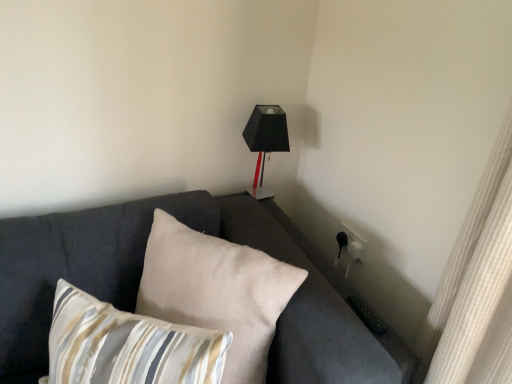
What do you see at coordinates (217, 291) in the screenshot? I see `beige fabric pillow at center, which is the first pillow in back-to-front order` at bounding box center [217, 291].

At what (x,y) coordinates should I click in order to perform the action: click on beige fabric pillow at center, which is the first pillow in back-to-front order. Please return your answer as a coordinate pair (x, y). This screenshot has width=512, height=384. Looking at the image, I should click on (217, 291).

This screenshot has width=512, height=384. What do you see at coordinates (127, 345) in the screenshot?
I see `striped fabric pillow at lower left, positioned as the 1th pillow in front-to-back order` at bounding box center [127, 345].

This screenshot has height=384, width=512. I want to click on dark gray fabric couch at center, so click(141, 273).

You are a GUI agent. You are given a task and a screenshot of the screen. Output one action in this format:
    pyautogui.click(x=<x>, y=<y>)
    Task: Click on the beige fabric pillow at center, which appears as the second pillow when viewed from the front
    The width and height of the screenshot is (512, 384).
    Given the screenshot: What is the action you would take?
    pyautogui.click(x=217, y=291)

Which of these two, matte black lampshade at upper right or striped fabric pillow at lower left, placed as the 2th pillow when sorted from back to front, stands taller?

matte black lampshade at upper right is taller.

Looking at their sizes, would you say matte black lampshade at upper right is wider or thinner than striped fabric pillow at lower left, placed as the 2th pillow when sorted from back to front?

matte black lampshade at upper right is thinner than striped fabric pillow at lower left, placed as the 2th pillow when sorted from back to front.

How much distance is there between matte black lampshade at upper right and striped fabric pillow at lower left, placed as the 2th pillow when sorted from back to front?

matte black lampshade at upper right is 32.29 inches away from striped fabric pillow at lower left, placed as the 2th pillow when sorted from back to front.

Does matte black lampshade at upper right appear on the left side of striped fabric pillow at lower left, placed as the 2th pillow when sorted from back to front?

No.

Is striped fabric pillow at lower left, positioned as the 1th pillow in front-to-back order, not near matte black lampshade at upper right?

No, striped fabric pillow at lower left, positioned as the 1th pillow in front-to-back order, is in close proximity to matte black lampshade at upper right.

Can you tell me how much striped fabric pillow at lower left, positioned as the 1th pillow in front-to-back order, and matte black lampshade at upper right differ in facing direction?

The angle between the facing direction of striped fabric pillow at lower left, positioned as the 1th pillow in front-to-back order, and the facing direction of matte black lampshade at upper right is 46.8 degrees.

From the image's perspective, relative to matte black lampshade at upper right, is striped fabric pillow at lower left, placed as the 2th pillow when sorted from back to front, above or below?

striped fabric pillow at lower left, placed as the 2th pillow when sorted from back to front, is situated lower than matte black lampshade at upper right in the image.

Does striped fabric pillow at lower left, positioned as the 1th pillow in front-to-back order, turn towards matte black lampshade at upper right?

No, striped fabric pillow at lower left, positioned as the 1th pillow in front-to-back order, does not turn towards matte black lampshade at upper right.

From the image's perspective, does striped fabric pillow at lower left, positioned as the 1th pillow in front-to-back order, appear higher than dark gray fabric couch at center?

No.

Based on the photo, does striped fabric pillow at lower left, placed as the 2th pillow when sorted from back to front, appear on the left side of dark gray fabric couch at center?

Yes.

Is striped fabric pillow at lower left, positioned as the 1th pillow in front-to-back order, wider than dark gray fabric couch at center?

No, striped fabric pillow at lower left, positioned as the 1th pillow in front-to-back order, is not wider than dark gray fabric couch at center.

Considering the relative sizes of dark gray fabric couch at center and striped fabric pillow at lower left, positioned as the 1th pillow in front-to-back order, in the image provided, is dark gray fabric couch at center thinner than striped fabric pillow at lower left, positioned as the 1th pillow in front-to-back order,?

Incorrect, the width of dark gray fabric couch at center is not less than that of striped fabric pillow at lower left, positioned as the 1th pillow in front-to-back order.

Is dark gray fabric couch at center not close to striped fabric pillow at lower left, positioned as the 1th pillow in front-to-back order?

That's not correct — dark gray fabric couch at center is a little close to striped fabric pillow at lower left, positioned as the 1th pillow in front-to-back order.

Is dark gray fabric couch at center completely or partially outside of striped fabric pillow at lower left, positioned as the 1th pillow in front-to-back order?

Yes, dark gray fabric couch at center is located beyond the bounds of striped fabric pillow at lower left, positioned as the 1th pillow in front-to-back order.

Is point (342, 284) closer to viewer compared to point (74, 317)?

That is False.

At what (x,y) coordinates should I click in order to perform the action: click on pillow that is the 2nd one when counting backward from the dark gray fabric couch at center. Please return your answer as a coordinate pair (x, y). Image resolution: width=512 pixels, height=384 pixels. Looking at the image, I should click on (217, 291).

Is dark gray fabric couch at center bigger than beige fabric pillow at center, which appears as the second pillow when viewed from the front?

Yes, dark gray fabric couch at center is bigger than beige fabric pillow at center, which appears as the second pillow when viewed from the front.

In the scene shown: Is dark gray fabric couch at center not close to beige fabric pillow at center, which appears as the second pillow when viewed from the front?

No, dark gray fabric couch at center is in close proximity to beige fabric pillow at center, which appears as the second pillow when viewed from the front.

From a real-world perspective, which object stands above the other?

dark gray fabric couch at center, from a real-world perspective.

Looking at this image, which object is more forward, beige fabric pillow at center, which is the first pillow in back-to-front order, or dark gray fabric couch at center?

Positioned in front is dark gray fabric couch at center.

From the image's perspective, is beige fabric pillow at center, which is the first pillow in back-to-front order, positioned above or below dark gray fabric couch at center?

Based on their image positions, beige fabric pillow at center, which is the first pillow in back-to-front order, is located beneath dark gray fabric couch at center.

Consider the image. Considering the positions of objects beige fabric pillow at center, which appears as the second pillow when viewed from the front, and dark gray fabric couch at center in the image provided, who is more to the right, beige fabric pillow at center, which appears as the second pillow when viewed from the front, or dark gray fabric couch at center?

beige fabric pillow at center, which appears as the second pillow when viewed from the front, is more to the right.

Can dark gray fabric couch at center be found inside matte black lampshade at upper right?

No, dark gray fabric couch at center is not inside matte black lampshade at upper right.

Which point is more distant from viewer, (x=273, y=143) or (x=83, y=232)?

Positioned behind is point (x=273, y=143).

Could you tell me if matte black lampshade at upper right is turned towards dark gray fabric couch at center?

No, matte black lampshade at upper right does not turn towards dark gray fabric couch at center.

From the image's perspective, between matte black lampshade at upper right and dark gray fabric couch at center, which one is located above?

matte black lampshade at upper right is shown above in the image.

Identify the location of table lamp lying behind the striped fabric pillow at lower left, positioned as the 1th pillow in front-to-back order. Image resolution: width=512 pixels, height=384 pixels. (265, 141).

From a real-world perspective, count 2nd pillows downward from the matte black lampshade at upper right and point to it. Please provide its 2D coordinates.

[(127, 345)]

Based on their spatial positions, is matte black lampshade at upper right or beige fabric pillow at center, which appears as the second pillow when viewed from the front, further from dark gray fabric couch at center?

matte black lampshade at upper right lies further to dark gray fabric couch at center than the other object.

Estimate the real-world distances between objects in this image. Which object is further from beige fabric pillow at center, which is the first pillow in back-to-front order, matte black lampshade at upper right or striped fabric pillow at lower left, positioned as the 1th pillow in front-to-back order?

Based on the image, matte black lampshade at upper right appears to be further to beige fabric pillow at center, which is the first pillow in back-to-front order.

From the image, which object appears to be nearer to striped fabric pillow at lower left, placed as the 2th pillow when sorted from back to front, dark gray fabric couch at center or beige fabric pillow at center, which is the first pillow in back-to-front order?

Based on the image, beige fabric pillow at center, which is the first pillow in back-to-front order, appears to be nearer to striped fabric pillow at lower left, placed as the 2th pillow when sorted from back to front.

Estimate the real-world distances between objects in this image. Which object is closer to matte black lampshade at upper right, dark gray fabric couch at center or striped fabric pillow at lower left, placed as the 2th pillow when sorted from back to front?

The object closer to matte black lampshade at upper right is dark gray fabric couch at center.

Which object lies further to the anchor point striped fabric pillow at lower left, positioned as the 1th pillow in front-to-back order, beige fabric pillow at center, which is the first pillow in back-to-front order, or dark gray fabric couch at center?

dark gray fabric couch at center is positioned further to the anchor striped fabric pillow at lower left, positioned as the 1th pillow in front-to-back order.

When comparing their distances from beige fabric pillow at center, which appears as the second pillow when viewed from the front, does striped fabric pillow at lower left, positioned as the 1th pillow in front-to-back order, or matte black lampshade at upper right seem further?

matte black lampshade at upper right is positioned further to the anchor beige fabric pillow at center, which appears as the second pillow when viewed from the front.

Looking at the image, which one is located further to beige fabric pillow at center, which is the first pillow in back-to-front order, striped fabric pillow at lower left, positioned as the 1th pillow in front-to-back order, or dark gray fabric couch at center?

striped fabric pillow at lower left, positioned as the 1th pillow in front-to-back order, is positioned further to the anchor beige fabric pillow at center, which is the first pillow in back-to-front order.

Estimate the real-world distances between objects in this image. Which object is closer to dark gray fabric couch at center, beige fabric pillow at center, which appears as the second pillow when viewed from the front, or striped fabric pillow at lower left, placed as the 2th pillow when sorted from back to front?

Among the two, beige fabric pillow at center, which appears as the second pillow when viewed from the front, is located nearer to dark gray fabric couch at center.

The height and width of the screenshot is (384, 512). Find the location of `pillow located between dark gray fabric couch at center and beige fabric pillow at center, which appears as the second pillow when viewed from the front, in the depth direction`. pillow located between dark gray fabric couch at center and beige fabric pillow at center, which appears as the second pillow when viewed from the front, in the depth direction is located at coordinates (127, 345).

The height and width of the screenshot is (384, 512). I want to click on pillow located between striped fabric pillow at lower left, positioned as the 1th pillow in front-to-back order, and matte black lampshade at upper right in the depth direction, so click(217, 291).